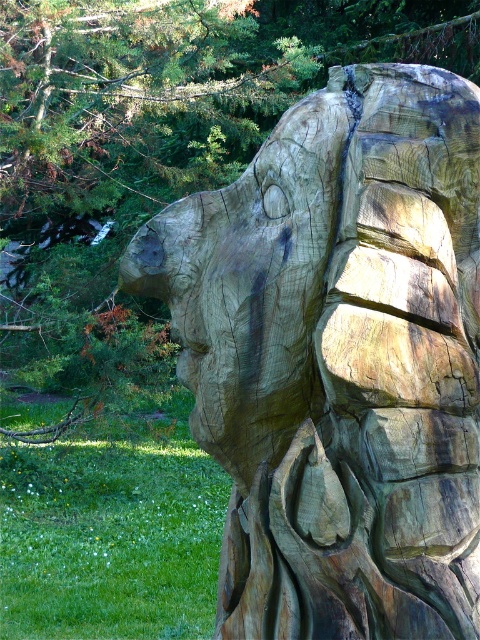
Question: Does natural wood carving at center appear under wooden carving at center?

Choices:
 (A) no
 (B) yes

Answer: (B)

Question: From the image, what is the correct spatial relationship of natural wood carving at center in relation to wooden carving at center?

Choices:
 (A) above
 (B) below

Answer: (B)

Question: Does natural wood carving at center have a smaller size compared to wooden carving at center?

Choices:
 (A) yes
 (B) no

Answer: (A)